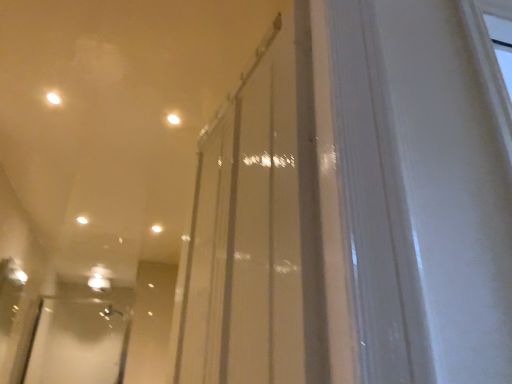
Question: In terms of size, does matte white light at upper center, positioned as the 1th light in front-to-back order, appear bigger or smaller than clear plastic screen door at lower left?

Choices:
 (A) small
 (B) big

Answer: (A)

Question: From a real-world perspective, is matte white light at upper center, the 3th light in the back-to-front sequence, above or below clear plastic screen door at lower left?

Choices:
 (A) above
 (B) below

Answer: (A)

Question: Which object is positioned closest to the white glossy light at center, the 1th light in the bottom-to-top sequence?

Choices:
 (A) transparent glass door at center
 (B) clear plastic screen door at lower left
 (C) matte white light at upper center, positioned as the 1th light in front-to-back order
 (D) white glossy light at upper center, which is counted as the 2th light, starting from the bottom

Answer: (D)

Question: Which object is positioned closest to the white glossy light at center, which is the third light from top to bottom?

Choices:
 (A) white glossy light at upper center, acting as the 2th light starting from the front
 (B) transparent glass door at center
 (C) clear plastic screen door at lower left
 (D) matte white light at upper center, which is the 3th light in bottom-to-top order

Answer: (A)